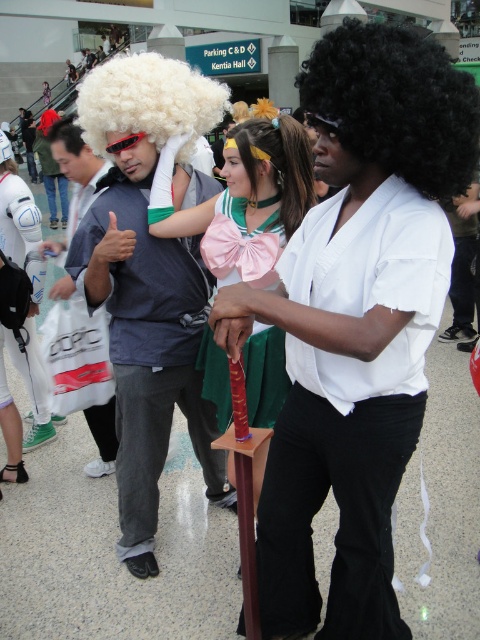
Question: Which object is positioned farthest from the white fluffy wig at center?

Choices:
 (A) black curly wig at center
 (B) white curly wig at upper left

Answer: (A)

Question: Can you confirm if white fluffy wig at center is bigger than black curly wig at center?

Choices:
 (A) no
 (B) yes

Answer: (B)

Question: Which object appears farthest from the camera in this image?

Choices:
 (A) pink satin bow at center
 (B) black curly wig at center
 (C) white matte backpack at left

Answer: (C)

Question: Which object is farther from the camera taking this photo?

Choices:
 (A) black curly wig at center
 (B) white fluffy wig at center

Answer: (B)

Question: Does white matte wig at center have a greater width compared to white fluffy wig at center?

Choices:
 (A) no
 (B) yes

Answer: (B)

Question: Does white matte backpack at left have a larger size compared to blonde synthetic wig at upper left?

Choices:
 (A) no
 (B) yes

Answer: (B)